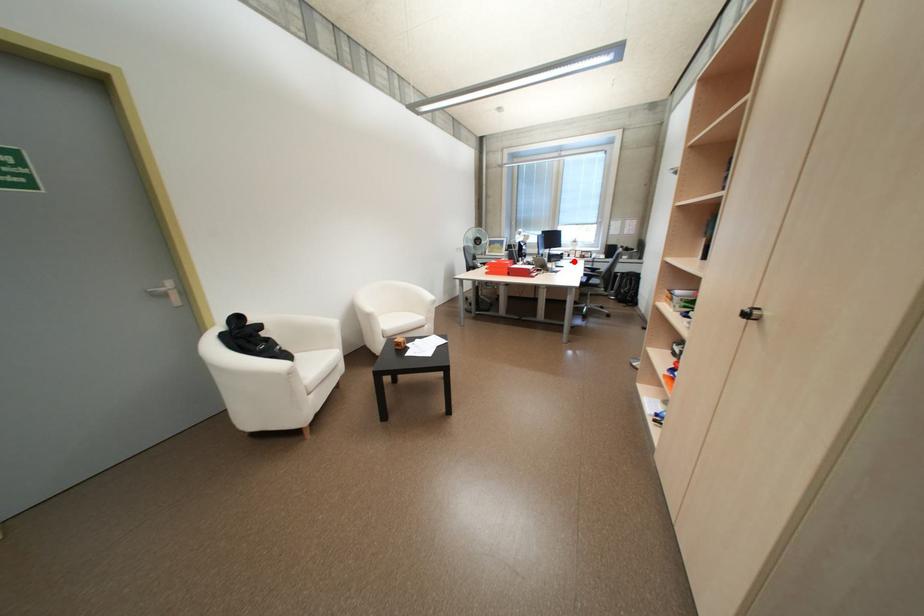
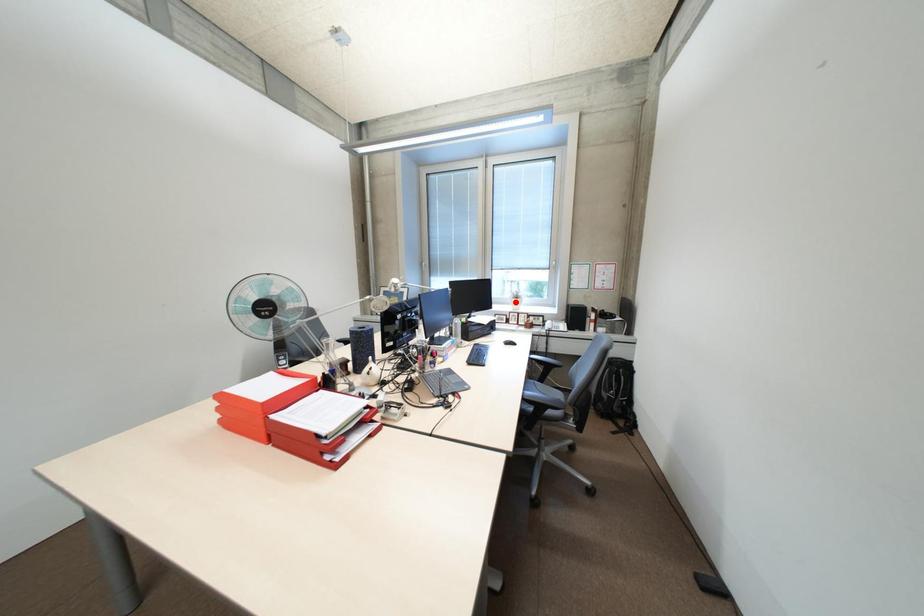
I am providing you with two images of the same scene from different viewpoints. A red point is marked on the first image and another point is marked on the second image. Are the points marked in image1 and image2 representing the same 3D position?

No